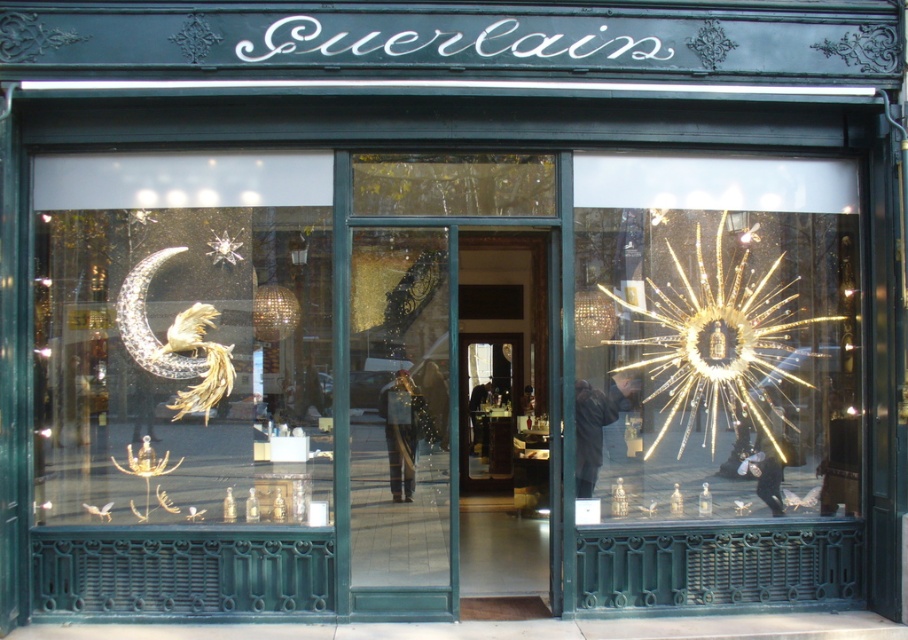
Question: Among these points, which one is farthest from the camera?

Choices:
 (A) (324, 454)
 (B) (859, 419)
 (C) (385, 397)

Answer: (B)

Question: Which of the following is the closest to the observer?

Choices:
 (A) shiny gold crescent moon at left
 (B) shiny gold starburst at center

Answer: (A)

Question: Is shiny gold crescent moon at left to the right of shiny gold starburst at center from the viewer's perspective?

Choices:
 (A) no
 (B) yes

Answer: (A)

Question: Among these objects, which one is nearest to the camera?

Choices:
 (A) shiny gold starburst at center
 (B) transparent glass door at center
 (C) shiny gold crescent moon at left

Answer: (C)

Question: Is shiny gold crescent moon at left positioned in front of transparent glass door at center?

Choices:
 (A) yes
 (B) no

Answer: (A)

Question: Can you confirm if shiny gold starburst at center is bigger than transparent glass door at center?

Choices:
 (A) yes
 (B) no

Answer: (A)